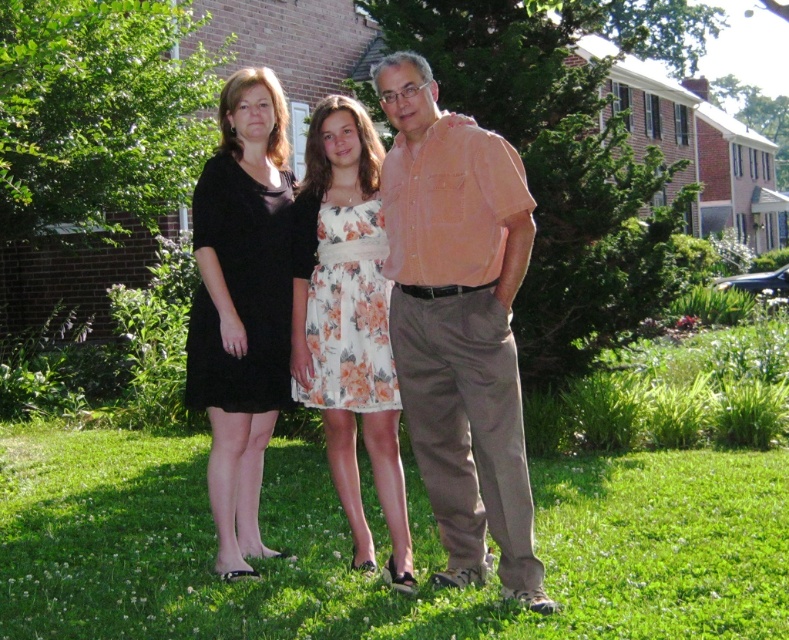
You are planning to place a small garden statue that requires a 1 meter wide space. You see the green grass at center and the black matte dress at center in the image. Which area can accommodate the statue?

The green grass at center might be wider than black matte dress at center, so the green grass at center is more likely to have enough space for the statue.

In the scene shown: You are standing on the green grass at center and want to walk towards the older man wearing a peach colored short sleeved shirt and beige. Which direction should you move?

You should move towards the right direction since the older man is on the right side of the green grass at center.

You are a photographer setting up a tripod to take a group photo of the light orange cotton shirt at center and the floral dress at center. Based on their heights, which one should you adjust the camera angle to focus on first?

The light orange cotton shirt at center is taller than the floral dress at center, so you should focus on the light orange cotton shirt at center first to ensure proper framing.